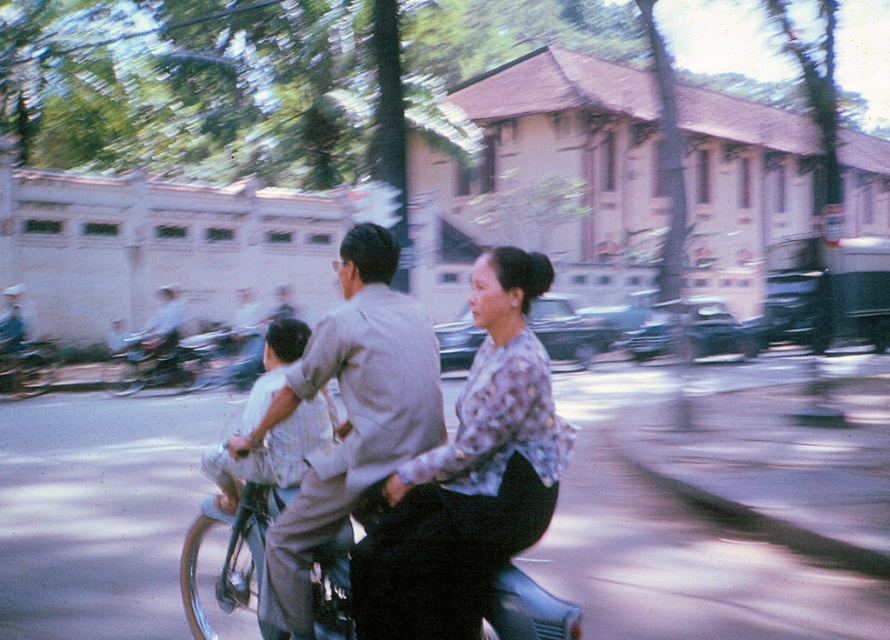
You are a photographer trying to capture the floral pattern on the adult in the middle of the motorbike. The motorbike is moving, but you have a chance to take a photo when the point at coordinate [470,476] is in focus. Will this point be on the floral patterned blouse?

Yes, the point at coordinate [470,476] is on the floral patterned blouse at center, so focusing there will capture the floral pattern.